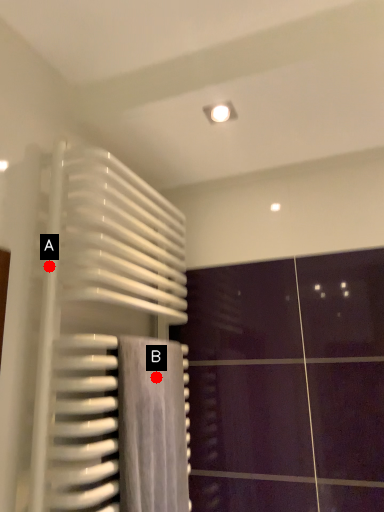
Question: Two points are circled on the image, labeled by A and B beside each circle. Which point is further to the camera?

Choices:
 (A) A is further
 (B) B is further

Answer: (B)